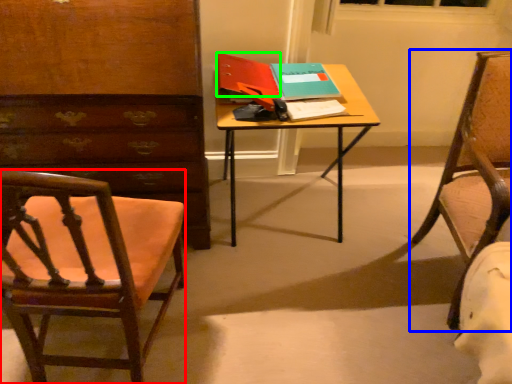
Question: Which is farther away from chair (highlighted by a red box)? chair (highlighted by a blue box) or book (highlighted by a green box)?

Choices:
 (A) chair
 (B) book

Answer: (A)